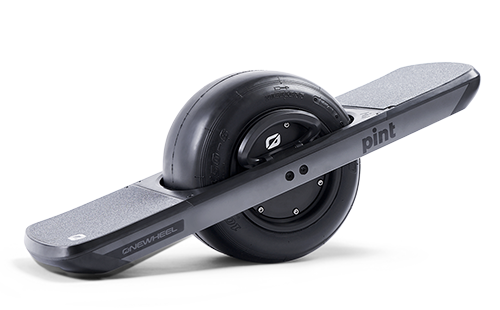
At what (x,y) coordinates should I click in order to perform the action: click on board. Please return your answer as a coordinate pair (x, y). The image size is (500, 310). Looking at the image, I should click on click(x=188, y=221).